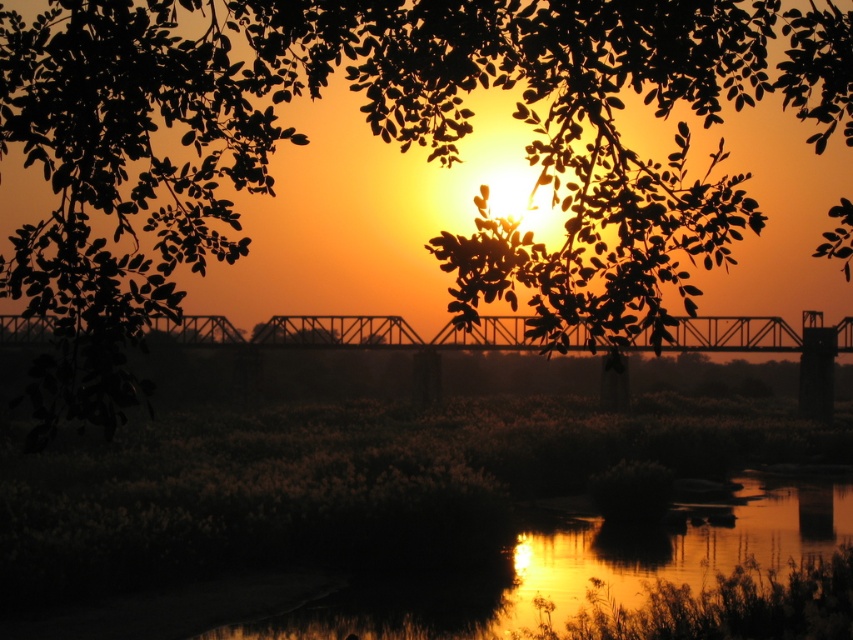
You are standing at the bridge looking towards the sunset. There are two points marked on the bridge. The first point is at coordinates point (x=805, y=627) and the second point is at point (x=790, y=349). Which point is closer to you?

Point (x=805, y=627) is closer to the camera than point (x=790, y=349), so the first point is closer to you.

You are an artist trying to paint this sunset scene. You want to ensure the green leafy tree at upper center and the shiny reflective water at center are proportionally accurate. Which object should you make wider in your painting?

The green leafy tree at upper center should be made wider in the painting since its width surpasses that of the shiny reflective water at center.

You are an architect designing a new pedestrian walkway that needs to cross over the water. You observe the shiny reflective water at center and the metallic bridge at center in the image. Which object is positioned lower in the scene?

The shiny reflective water at center is located below the metallic bridge at center, so it is positioned lower in the scene.